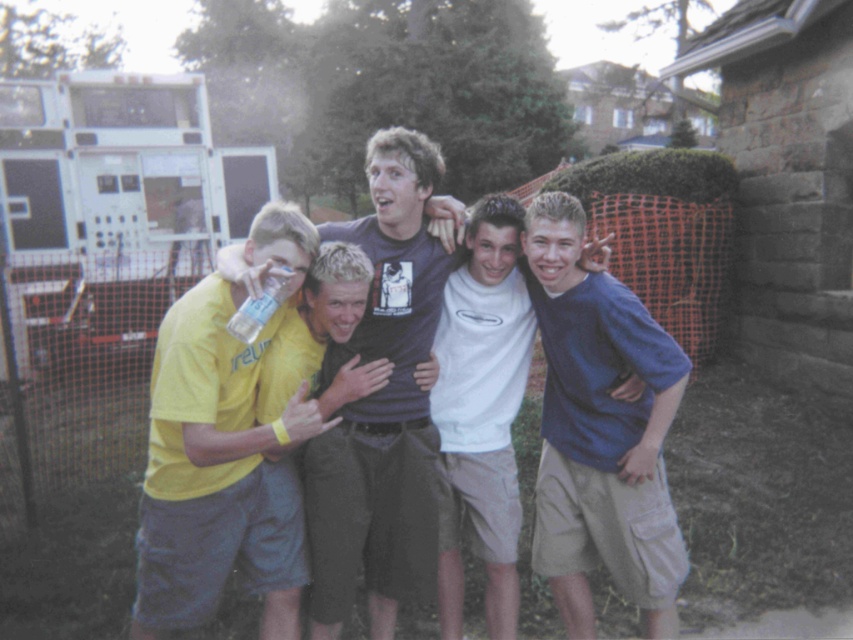
Question: Which is farther from the clear plastic bottle at center?

Choices:
 (A) yellow fabric shirt at center
 (B) blue cotton shirt at center
 (C) white cotton t-shirt at center
 (D) yellow matte t-shirt at left

Answer: (B)

Question: Does blue cotton shirt at center appear over white cotton t-shirt at center?

Choices:
 (A) no
 (B) yes

Answer: (A)

Question: From the image, what is the correct spatial relationship of white cotton t-shirt at center in relation to yellow fabric shirt at center?

Choices:
 (A) above
 (B) below

Answer: (B)

Question: Among these objects, which one is farthest from the camera?

Choices:
 (A) dark blue t-shirt at center
 (B) yellow matte t-shirt at left
 (C) yellow fabric shirt at center
 (D) blue cotton shirt at center

Answer: (A)

Question: Which point is closer to the camera taking this photo?

Choices:
 (A) (352, 394)
 (B) (140, 532)
 (C) (601, 374)
 (D) (486, 515)

Answer: (A)

Question: Does dark blue t-shirt at center have a smaller size compared to clear plastic bottle at center?

Choices:
 (A) no
 (B) yes

Answer: (A)